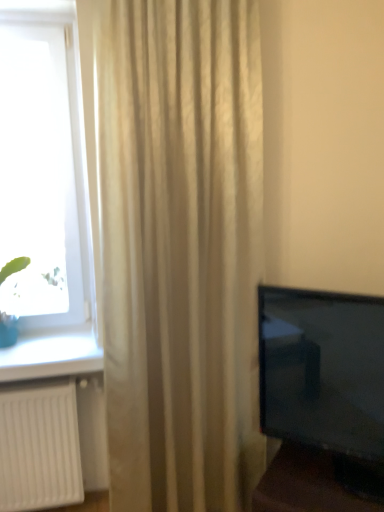
Question: From the image's perspective, would you say green leafy plant at left is positioned over beige textured curtain at center?

Choices:
 (A) no
 (B) yes

Answer: (B)

Question: From the image's perspective, is green leafy plant at left under beige textured curtain at center?

Choices:
 (A) no
 (B) yes

Answer: (A)

Question: Can you confirm if green leafy plant at left is wider than beige textured curtain at center?

Choices:
 (A) no
 (B) yes

Answer: (A)

Question: Considering the relative positions of green leafy plant at left and beige textured curtain at center in the image provided, is green leafy plant at left to the left of beige textured curtain at center from the viewer's perspective?

Choices:
 (A) yes
 (B) no

Answer: (A)

Question: Is green leafy plant at left looking in the opposite direction of beige textured curtain at center?

Choices:
 (A) yes
 (B) no

Answer: (B)

Question: Considering the positions of point (13, 322) and point (82, 151), is point (13, 322) closer or farther from the camera than point (82, 151)?

Choices:
 (A) closer
 (B) farther

Answer: (B)

Question: From the image's perspective, is green leafy plant at left located above or below transparent glass window at left?

Choices:
 (A) below
 (B) above

Answer: (A)

Question: In terms of width, does green leafy plant at left look wider or thinner when compared to transparent glass window at left?

Choices:
 (A) wide
 (B) thin

Answer: (A)

Question: From a real-world perspective, is green leafy plant at left above or below transparent glass window at left?

Choices:
 (A) below
 (B) above

Answer: (A)

Question: In terms of size, does beige textured curtain at center appear bigger or smaller than green leafy plant at left?

Choices:
 (A) small
 (B) big

Answer: (B)

Question: Is beige textured curtain at center taller or shorter than green leafy plant at left?

Choices:
 (A) short
 (B) tall

Answer: (B)

Question: Is beige textured curtain at center to the left or to the right of green leafy plant at left in the image?

Choices:
 (A) left
 (B) right

Answer: (B)

Question: In terms of width, does beige textured curtain at center look wider or thinner when compared to green leafy plant at left?

Choices:
 (A) thin
 (B) wide

Answer: (B)

Question: From the image's perspective, is green leafy plant at left located above or below beige textured curtain at center?

Choices:
 (A) below
 (B) above

Answer: (B)

Question: Is green leafy plant at left wider or thinner than beige textured curtain at center?

Choices:
 (A) wide
 (B) thin

Answer: (B)